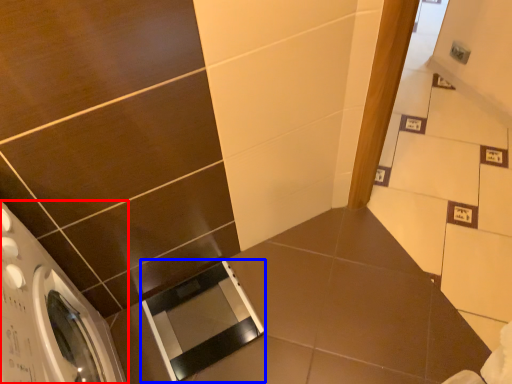
Question: Which object is closer to the camera taking this photo, washing machine (highlighted by a red box) or screen door (highlighted by a blue box)?

Choices:
 (A) washing machine
 (B) screen door

Answer: (A)